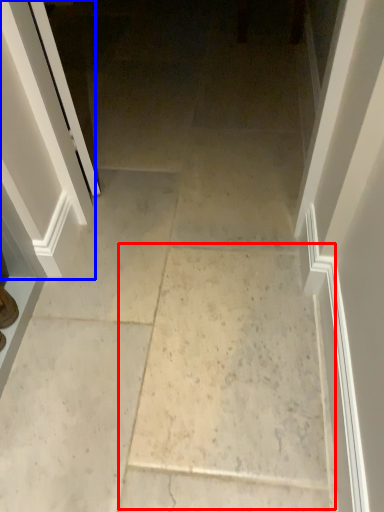
Question: Among these objects, which one is nearest to the camera, concrete (highlighted by a red box) or screen door (highlighted by a blue box)?

Choices:
 (A) concrete
 (B) screen door

Answer: (A)